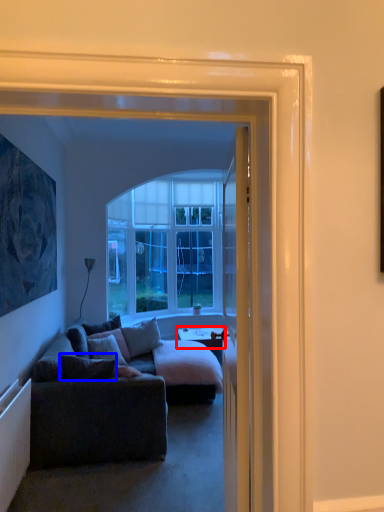
Question: Which object is further to the camera taking this photo, desk (highlighted by a red box) or pillow (highlighted by a blue box)?

Choices:
 (A) desk
 (B) pillow

Answer: (A)